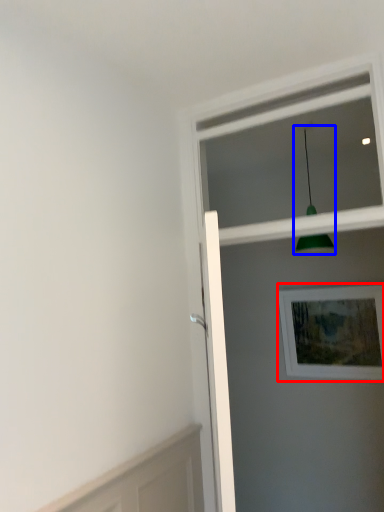
Question: Which of the following is the farthest to the observer, picture frame (highlighted by a red box) or light fixture (highlighted by a blue box)?

Choices:
 (A) picture frame
 (B) light fixture

Answer: (A)